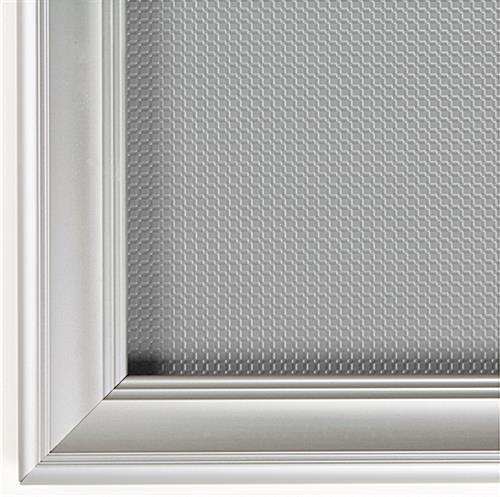
Find the location of a particular element. inside edge of frame is located at coordinates (124, 141), (385, 379).